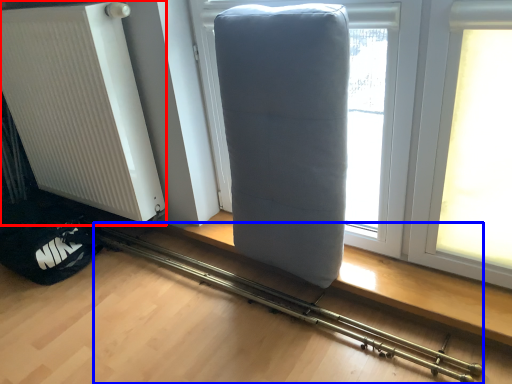
Question: Which of the following is the closest to the observer, radiator (highlighted by a red box) or equipment (highlighted by a blue box)?

Choices:
 (A) radiator
 (B) equipment

Answer: (B)